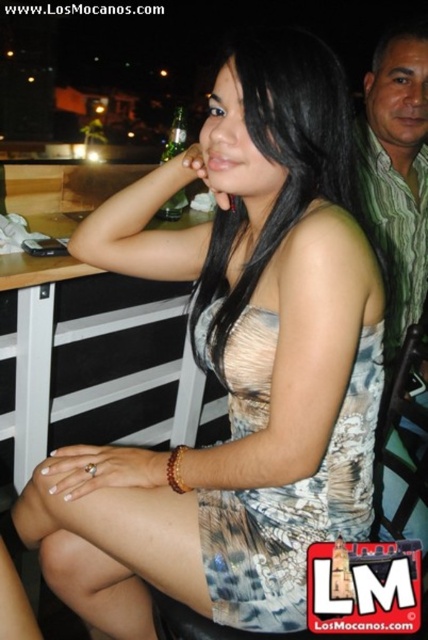
You are a photographer trying to capture a candid shot of the printed fabric dress at center and the white wood table at center. Which object should you focus on first if you want to ensure both are in the frame without moving the camera?

You should focus on the printed fabric dress at center first because it is shorter than the white wood table at center, so it will be closer to the camera. This way, adjusting the focus from near to far will help both objects be in the frame.

You are a photographer trying to capture the perfect shot of the woman in the scene. You notice two points of interest marked at coordinates point (395, 74) and point (169, 198). Which point is closer to the camera based on their positions?

Point (395, 74) is in front of point (169, 198), so it is closer to the camera.